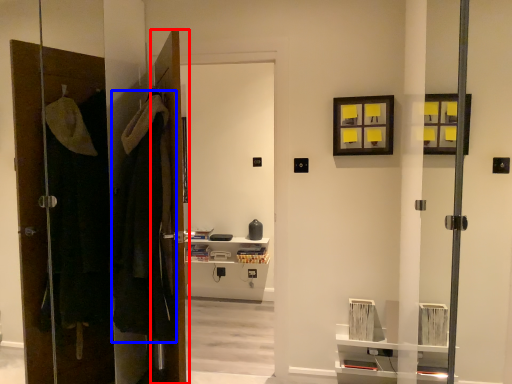
Question: Among these objects, which one is farthest to the camera, door (highlighted by a red box) or robe (highlighted by a blue box)?

Choices:
 (A) door
 (B) robe

Answer: (A)